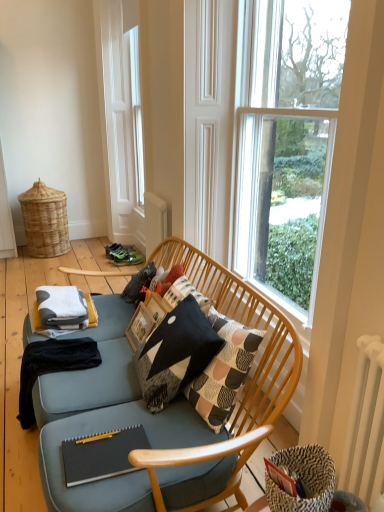
Question: Based on their sizes in the image, would you say white metallic radiator at right is bigger or smaller than clear glass window at upper right?

Choices:
 (A) big
 (B) small

Answer: (B)

Question: Visually, is white metallic radiator at right positioned to the left or to the right of clear glass window at upper right?

Choices:
 (A) left
 (B) right

Answer: (B)

Question: Estimate the real-world distances between objects in this image. Which object is farther from the woven natural basket at left?

Choices:
 (A) black matte notebook at lower center
 (B) black cotton blanket at lower left
 (C) black textured throw pillow at center
 (D) white metallic radiator at right
 (E) patterned woven basket at lower right

Answer: (D)

Question: Based on their relative distances, which object is farther from the black cotton blanket at lower left?

Choices:
 (A) black matte notebook at lower center
 (B) white metallic radiator at right
 (C) patterned woven basket at lower right
 (D) white cotton blanket at lower left
 (E) woven natural basket at left

Answer: (E)